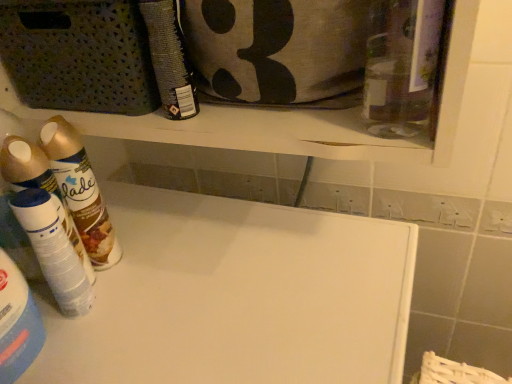
What is the approximate height of gold metallic spray can at left, the third cleaning product positioned from the right?

gold metallic spray can at left, the third cleaning product positioned from the right, is 9.00 inches in height.

In order to face matte black spray can at upper center, acting as the 3th cleaning product starting from the left, should I rotate leftwards or rightwards?

Turn left approximately 11.997 degrees to face it.

Describe the element at coordinates (237, 297) in the screenshot. The image size is (512, 384). I see `white matte board at center` at that location.

Locate an element on the screen. textured gray fabric pouch at upper center is located at coordinates (275, 48).

Is the depth of white matte board at center greater than that of gold metallic spray can at left, the third cleaning product positioned from the right?

No, it is not.

Is the surface of white matte board at center in direct contact with gold metallic spray can at left, the first cleaning product in the left-to-right sequence?

No, white matte board at center is not next to gold metallic spray can at left, the first cleaning product in the left-to-right sequence.

From the image's perspective, does white matte board at center appear higher than gold metallic spray can at left, the first cleaning product in the left-to-right sequence?

Incorrect, from the image's perspective, white matte board at center is lower than gold metallic spray can at left, the first cleaning product in the left-to-right sequence.

How far apart are white matte board at center and gold metallic spray can at left, the first cleaning product in the left-to-right sequence?

white matte board at center and gold metallic spray can at left, the first cleaning product in the left-to-right sequence, are 7.75 inches apart.

Is the depth of gold metallic spray can at left, the third cleaning product positioned from the right, less than that of white plastic spray can at left, positioned as the second cleaning product in left-to-right order?

No.

From the image's perspective, which one is positioned higher, gold metallic spray can at left, the first cleaning product in the left-to-right sequence, or white plastic spray can at left, positioned as the second cleaning product in right-to-left order?

gold metallic spray can at left, the first cleaning product in the left-to-right sequence, is shown above in the image.

From a real-world perspective, is gold metallic spray can at left, the third cleaning product positioned from the right, above or below white plastic spray can at left, positioned as the second cleaning product in left-to-right order?

Clearly, from a real-world perspective, gold metallic spray can at left, the third cleaning product positioned from the right, is above white plastic spray can at left, positioned as the second cleaning product in left-to-right order.

Can we say gold metallic spray can at left, the third cleaning product positioned from the right, lies outside white plastic spray can at left, positioned as the second cleaning product in left-to-right order?

Indeed, gold metallic spray can at left, the third cleaning product positioned from the right, is completely outside white plastic spray can at left, positioned as the second cleaning product in left-to-right order.

Considering the sizes of textured gray fabric pouch at upper center and gold metallic spray can at left, the first cleaning product in the left-to-right sequence, in the image, is textured gray fabric pouch at upper center bigger or smaller than gold metallic spray can at left, the first cleaning product in the left-to-right sequence,?

Clearly, textured gray fabric pouch at upper center is larger in size than gold metallic spray can at left, the first cleaning product in the left-to-right sequence.

Choose the correct answer: Is textured gray fabric pouch at upper center inside gold metallic spray can at left, the first cleaning product in the left-to-right sequence, or outside it?

textured gray fabric pouch at upper center exists outside the volume of gold metallic spray can at left, the first cleaning product in the left-to-right sequence.

Which is further, [248,78] or [71,179]?

Point [71,179]

From the image's perspective, does textured gray fabric pouch at upper center appear higher than gold metallic spray can at left, the third cleaning product positioned from the right?

Yes, from the image's perspective, textured gray fabric pouch at upper center is above gold metallic spray can at left, the third cleaning product positioned from the right.

From the picture: From the image's perspective, between matte black spray can at upper center, acting as the 3th cleaning product starting from the left, and white matte board at center, which one is located above?

matte black spray can at upper center, acting as the 3th cleaning product starting from the left, from the image's perspective.

Is matte black spray can at upper center, acting as the 3th cleaning product starting from the left, outside of white matte board at center?

Indeed, matte black spray can at upper center, acting as the 3th cleaning product starting from the left, is completely outside white matte board at center.

Can you tell me how much matte black spray can at upper center, acting as the 3th cleaning product starting from the left, and white matte board at center differ in facing direction?

The angular difference between matte black spray can at upper center, acting as the 3th cleaning product starting from the left, and white matte board at center is 0.156 degrees.

Identify the location of counter below the matte black spray can at upper center, the first cleaning product viewed from the right (from the image's perspective). (237, 297).

Considering the sizes of objects matte black spray can at upper center, acting as the 3th cleaning product starting from the left, and white plastic spray can at left, positioned as the second cleaning product in left-to-right order, in the image provided, who is smaller, matte black spray can at upper center, acting as the 3th cleaning product starting from the left, or white plastic spray can at left, positioned as the second cleaning product in left-to-right order,?

matte black spray can at upper center, acting as the 3th cleaning product starting from the left, is smaller.

From the image's perspective, is matte black spray can at upper center, the first cleaning product viewed from the right, under white plastic spray can at left, positioned as the second cleaning product in left-to-right order?

No, from the image's perspective, matte black spray can at upper center, the first cleaning product viewed from the right, is not below white plastic spray can at left, positioned as the second cleaning product in left-to-right order.

How many degrees apart are the facing directions of matte black spray can at upper center, the first cleaning product viewed from the right, and white plastic spray can at left, positioned as the second cleaning product in right-to-left order?

They differ by 89.1 degrees in their facing directions.

From a real-world perspective, which is physically above, matte black spray can at upper center, acting as the 3th cleaning product starting from the left, or white plastic spray can at left, positioned as the second cleaning product in left-to-right order?

matte black spray can at upper center, acting as the 3th cleaning product starting from the left, is physically above.

From the picture: Which object is closer to the camera taking this photo, gold metallic spray can at left, the third cleaning product positioned from the right, or matte black spray can at upper center, the first cleaning product viewed from the right?

matte black spray can at upper center, the first cleaning product viewed from the right, is more forward.

Is gold metallic spray can at left, the first cleaning product in the left-to-right sequence, to the right of matte black spray can at upper center, the first cleaning product viewed from the right, from the viewer's perspective?

No.

Which is in front, point (72, 188) or point (168, 78)?

The point (168, 78) is in front.

Is gold metallic spray can at left, the first cleaning product in the left-to-right sequence, oriented towards matte black spray can at upper center, the first cleaning product viewed from the right?

No, gold metallic spray can at left, the first cleaning product in the left-to-right sequence, is not oriented towards matte black spray can at upper center, the first cleaning product viewed from the right.

From the picture: Could you tell me if gold metallic spray can at left, the first cleaning product in the left-to-right sequence, is facing white matte board at center?

No, gold metallic spray can at left, the first cleaning product in the left-to-right sequence, is not facing towards white matte board at center.

Visually, is gold metallic spray can at left, the third cleaning product positioned from the right, positioned to the left or to the right of white matte board at center?

Based on their positions, gold metallic spray can at left, the third cleaning product positioned from the right, is located to the left of white matte board at center.

From the image's perspective, which one is positioned lower, gold metallic spray can at left, the third cleaning product positioned from the right, or white matte board at center?

white matte board at center appears lower in the image.

Is gold metallic spray can at left, the first cleaning product in the left-to-right sequence, in front of or behind white matte board at center in the image?

gold metallic spray can at left, the first cleaning product in the left-to-right sequence, is behind white matte board at center.

Identify the location of the 3rd cleaning product to the left when counting from the white matte board at center. (80, 191).

Locate an element on the screen. cleaning product that is the 1st object located in front of the gold metallic spray can at left, the third cleaning product positioned from the right is located at coordinates (53, 251).

Based on their spatial positions, is white plastic spray can at left, positioned as the second cleaning product in left-to-right order, or gold metallic spray can at left, the third cleaning product positioned from the right, further from matte black spray can at upper center, the first cleaning product viewed from the right?

white plastic spray can at left, positioned as the second cleaning product in left-to-right order, is further to matte black spray can at upper center, the first cleaning product viewed from the right.

Considering their positions, is white matte board at center positioned closer to white plastic spray can at left, positioned as the second cleaning product in right-to-left order, than textured gray fabric pouch at upper center?

white matte board at center.

From the picture: From the image, which object appears to be nearer to textured gray fabric pouch at upper center, white plastic spray can at left, positioned as the second cleaning product in left-to-right order, or white matte board at center?

white matte board at center.

Estimate the real-world distances between objects in this image. Which object is further from textured gray fabric pouch at upper center, matte black spray can at upper center, the first cleaning product viewed from the right, or white matte board at center?

white matte board at center.

Considering their positions, is matte black spray can at upper center, acting as the 3th cleaning product starting from the left, positioned closer to gold metallic spray can at left, the first cleaning product in the left-to-right sequence, than white plastic spray can at left, positioned as the second cleaning product in right-to-left order?

white plastic spray can at left, positioned as the second cleaning product in right-to-left order, is positioned closer to the anchor gold metallic spray can at left, the first cleaning product in the left-to-right sequence.

Considering their positions, is gold metallic spray can at left, the first cleaning product in the left-to-right sequence, positioned closer to white matte board at center than white plastic spray can at left, positioned as the second cleaning product in left-to-right order?

gold metallic spray can at left, the first cleaning product in the left-to-right sequence, is positioned closer to the anchor white matte board at center.

Which object lies further to the anchor point white matte board at center, matte black spray can at upper center, acting as the 3th cleaning product starting from the left, or gold metallic spray can at left, the first cleaning product in the left-to-right sequence?

The object further to white matte board at center is matte black spray can at upper center, acting as the 3th cleaning product starting from the left.

Considering their positions, is gold metallic spray can at left, the first cleaning product in the left-to-right sequence, positioned further to matte black spray can at upper center, the first cleaning product viewed from the right, than textured gray fabric pouch at upper center?

The object further to matte black spray can at upper center, the first cleaning product viewed from the right, is gold metallic spray can at left, the first cleaning product in the left-to-right sequence.

Identify the location of cleaning product between matte black spray can at upper center, acting as the 3th cleaning product starting from the left, and white plastic spray can at left, positioned as the second cleaning product in right-to-left order, from top to bottom. (80, 191).

Locate an element on the screen. This screenshot has height=384, width=512. cleaning product between gold metallic spray can at left, the first cleaning product in the left-to-right sequence, and white matte board at center vertically is located at coordinates (53, 251).